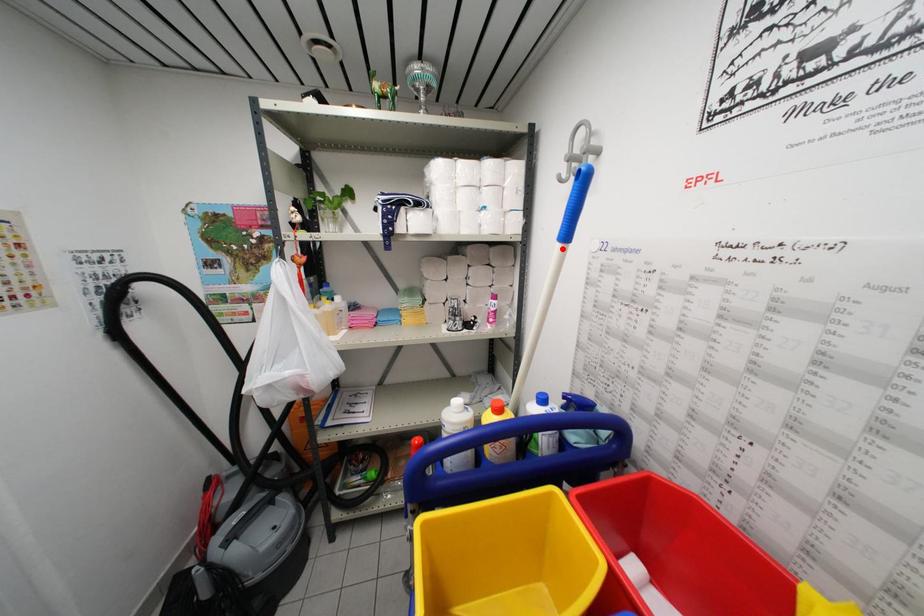
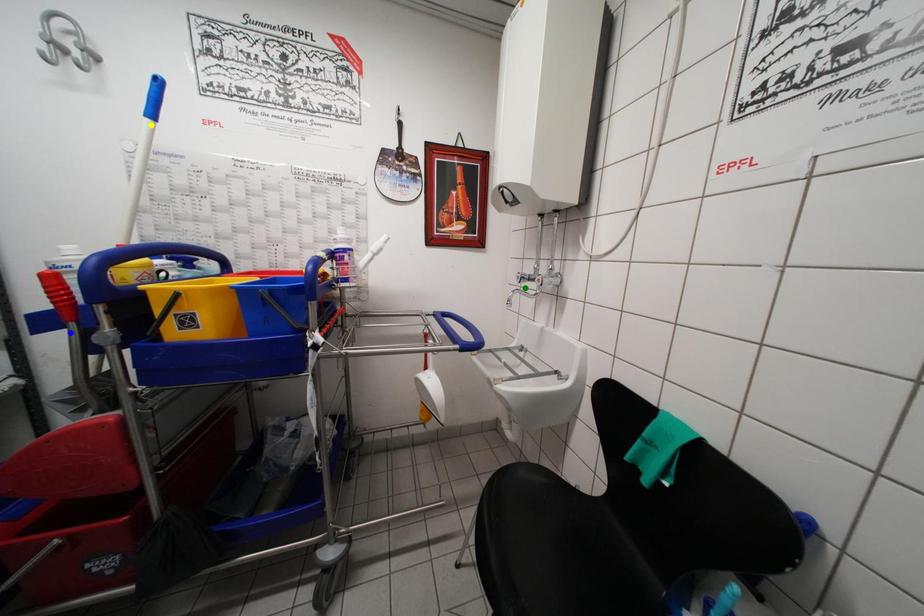
Question: I am providing you with two images of the same scene from different viewpoints. A red point is marked on the first image. You are given multiple points on the second image. Which mark in image 2 goes with the point in image 1?

Choices:
 (A) blue point
 (B) green point
 (C) yellow point

Answer: (C)